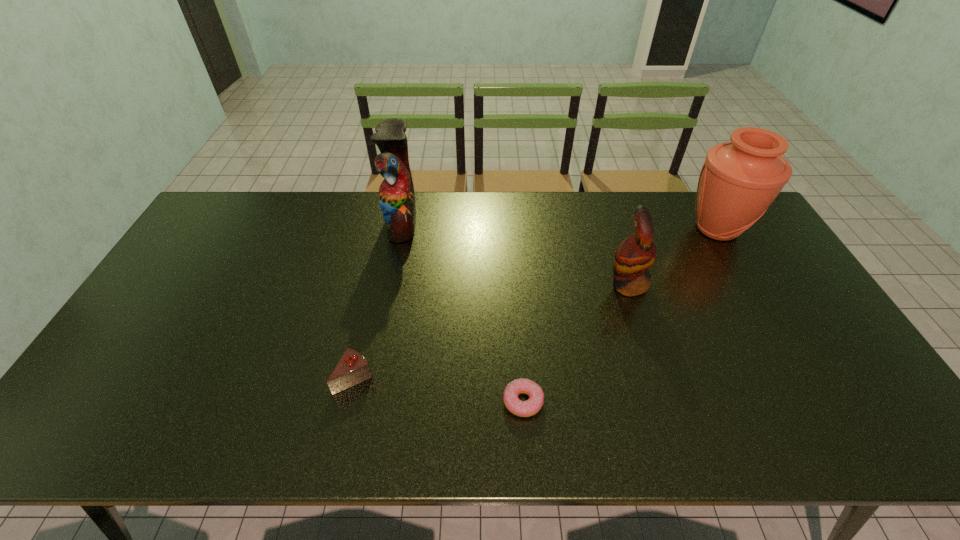
Locate an element on the screen. The width and height of the screenshot is (960, 540). vacant space in between the third farthest object and the taller parrot is located at coordinates (515, 253).

This screenshot has height=540, width=960. Find the location of `empty location between the third object from left to right and the taller parrot`. empty location between the third object from left to right and the taller parrot is located at coordinates (463, 312).

At what (x,y) coordinates should I click in order to perform the action: click on vacant region between the third object from left to right and the rightmost object. Please return your answer as a coordinate pair (x, y). Image resolution: width=960 pixels, height=540 pixels. Looking at the image, I should click on (620, 315).

Identify the location of free space between the fourth tallest object and the shorter parrot. (491, 331).

The image size is (960, 540). In order to click on object that is the fourth nearest to the third object from right to left in this screenshot , I will do `click(739, 180)`.

Where is `object that stands as the second closest to the farther parrot`? The image size is (960, 540). object that stands as the second closest to the farther parrot is located at coordinates (530, 407).

Find the location of a particular element. vacant point that satisfies the following two spatial constraints: 1. at the face of the farther parrot; 2. on the right side of the rightmost object is located at coordinates (400, 229).

At what (x,y) coordinates should I click in order to perform the action: click on vacant space that satisfies the following two spatial constraints: 1. at the face of the taller parrot; 2. on the right side of the doughnut. Please return your answer as a coordinate pair (x, y). The width and height of the screenshot is (960, 540). Looking at the image, I should click on (367, 401).